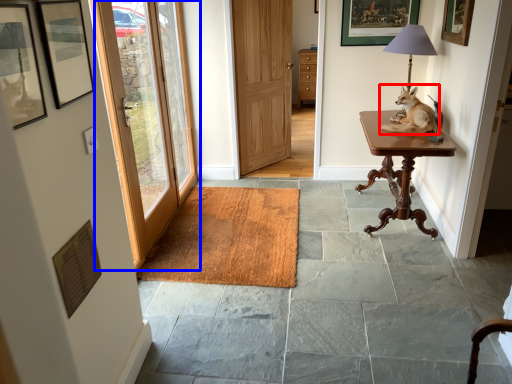
Question: Which object is closer to the camera taking this photo, dog (highlighted by a red box) or door (highlighted by a blue box)?

Choices:
 (A) dog
 (B) door

Answer: (B)